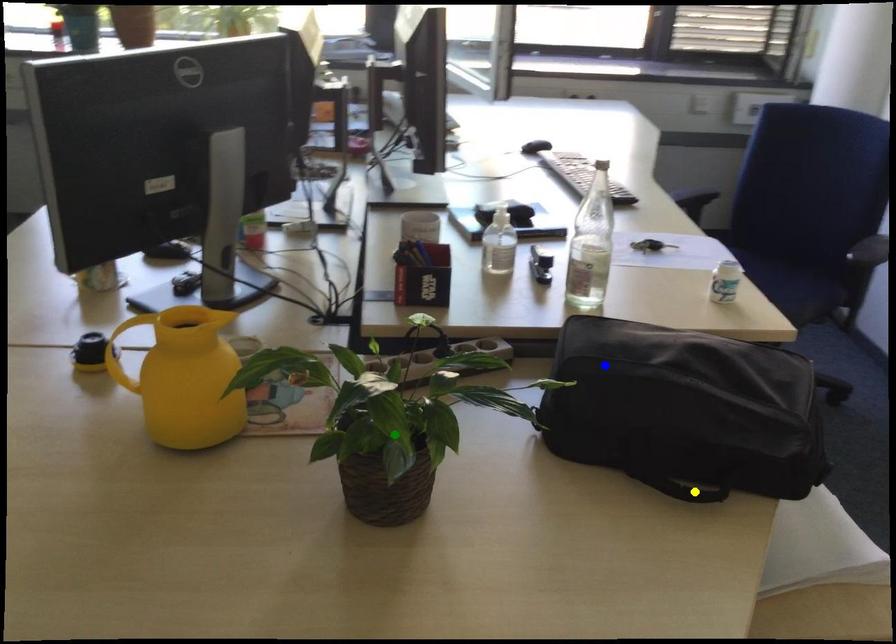
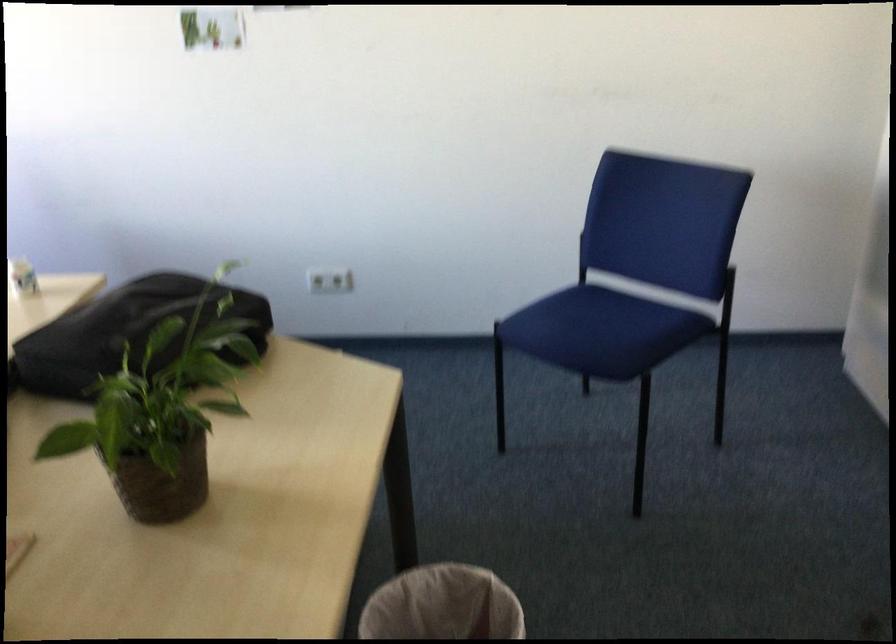
I am providing you with two images of the same scene from different viewpoints. Three points are marked in image1. Which point corresponds to a part or object that is occluded in image2?In image1, three points are marked. Which of them correspond to a part or object that is occluded in image2?Among the three points shown in image1, which one corresponds to a part or object that is no longer visible due to occlusion in image2?

yellow point